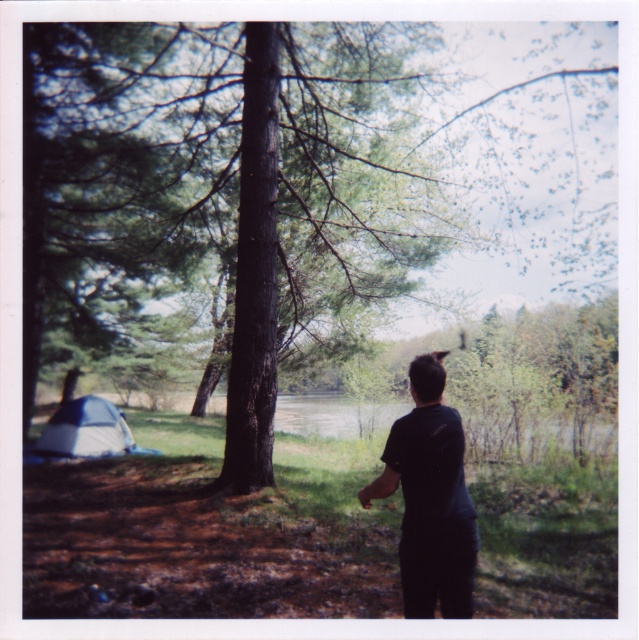
Question: Which of these objects is positioned closest to the black matte shirt at center?

Choices:
 (A) green rough bark tree at center
 (B) gray fabric tent at lower left

Answer: (B)

Question: Does green rough bark tree at center appear over gray fabric tent at lower left?

Choices:
 (A) yes
 (B) no

Answer: (A)

Question: Which point is closer to the camera?

Choices:
 (A) green rough bark tree at center
 (B) black matte shirt at center

Answer: (B)

Question: From the image, what is the correct spatial relationship of black matte shirt at center in relation to gray fabric tent at lower left?

Choices:
 (A) below
 (B) above

Answer: (B)

Question: Considering the real-world distances, which object is farthest from the gray fabric tent at lower left?

Choices:
 (A) black matte shirt at center
 (B) green rough bark tree at center

Answer: (A)

Question: Is black matte shirt at center to the left of gray fabric tent at lower left from the viewer's perspective?

Choices:
 (A) yes
 (B) no

Answer: (B)